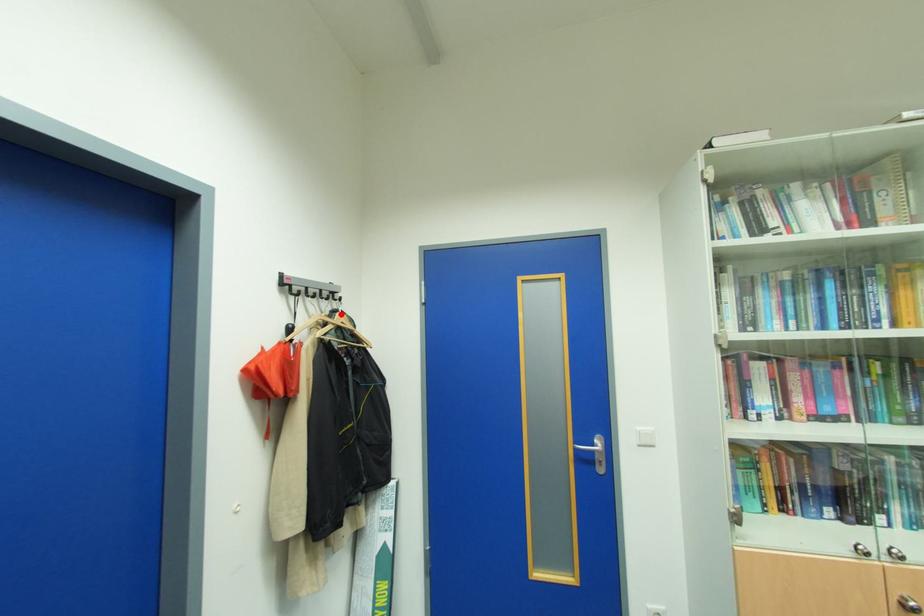
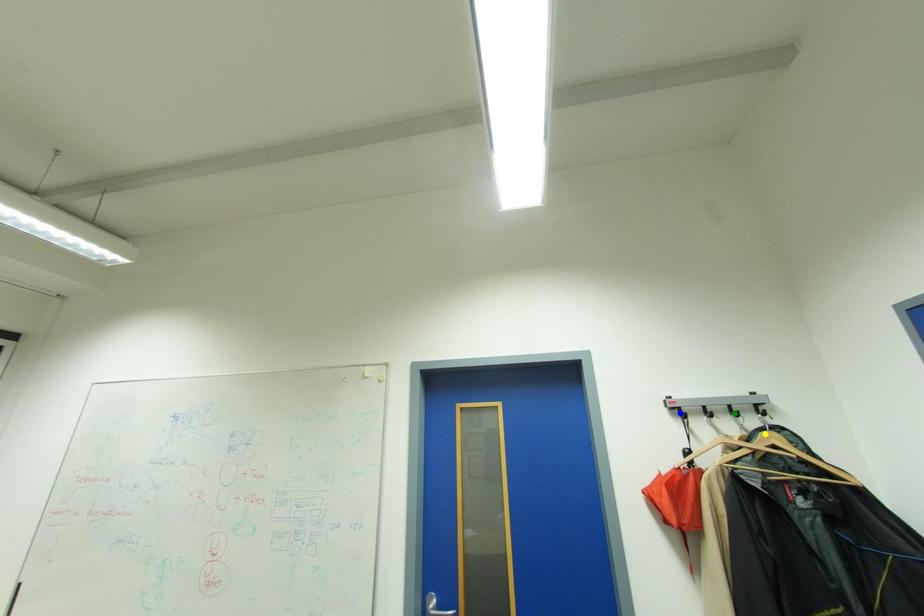
Question: I am providing you with two images of the same scene from different viewpoints. A red point is marked on the first image. You are given multiple points on the second image. Which mark in image 2 goes with the point in image 1?

Choices:
 (A) blue point
 (B) yellow point
 (C) green point

Answer: (B)